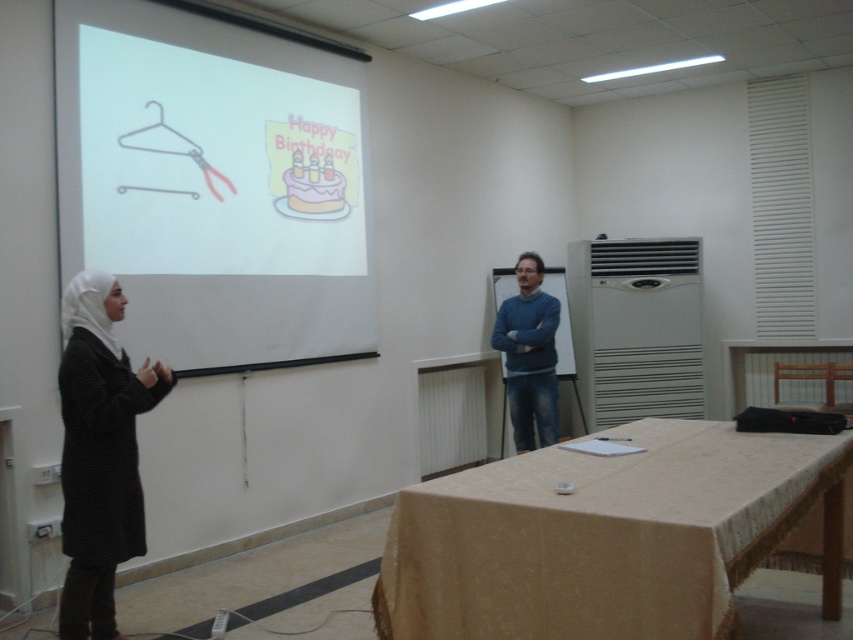
You are standing in the classroom facing the white matte projection screen at upper left. If you want to reach the screen, which direction should you move relative to your current position?

Since the white matte projection screen at upper left is at point (213, 186), you should move towards the upper left direction to reach it.

Consider the image. You are sitting in the front row of the classroom facing the screen. There are two points marked on the screen. Which point is closer to you, point (224, 84) or point (670, 435)?

Point (224, 84) is closer to you because it is further to the viewer than point (670, 435).

In the scene shown: You are an interior designer planning to install a new lighting fixture in this room. You need to know the relative sizes of the white matte projection screen at upper left and the metallic hanger at upper left to ensure proper placement. Which object is wider?

The white matte projection screen at upper left is wider than the metallic hanger at upper left.